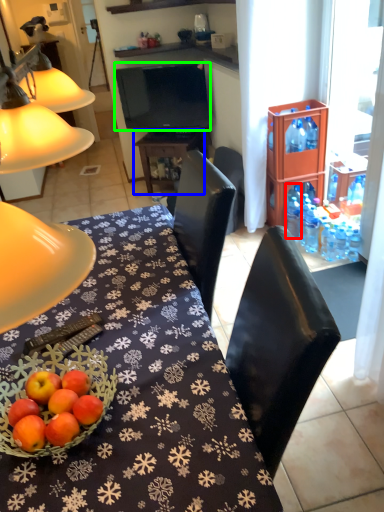
Question: Considering the real-world distances, which object is closest to bottle (highlighted by a red box)? table (highlighted by a blue box) or television (highlighted by a green box).

Choices:
 (A) table
 (B) television

Answer: (A)